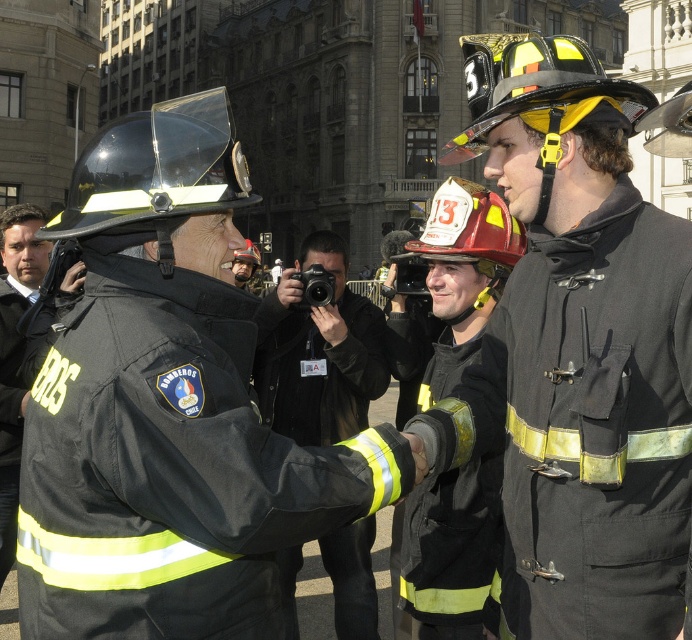
Question: Estimate the real-world distances between objects in this image. Which object is farther from the black matte uniform at left?

Choices:
 (A) black fabric uniform at center
 (B) matte black helmet at center

Answer: (B)

Question: Considering the relative positions of black matte uniform at center and black matte uniform at left in the image provided, where is black matte uniform at center located with respect to black matte uniform at left?

Choices:
 (A) right
 (B) left

Answer: (A)

Question: Does black fabric uniform at center appear on the left side of black matte uniform at left?

Choices:
 (A) yes
 (B) no

Answer: (B)

Question: Does black fabric uniform at center appear on the left side of black matte uniform at center?

Choices:
 (A) yes
 (B) no

Answer: (A)

Question: Among these points, which one is nearest to the camera?

Choices:
 (A) (552, 564)
 (B) (302, 364)
 (C) (163, 580)

Answer: (C)

Question: Which of the following is the closest to the observer?

Choices:
 (A) (19, 209)
 (B) (556, 458)
 (C) (435, 611)

Answer: (B)